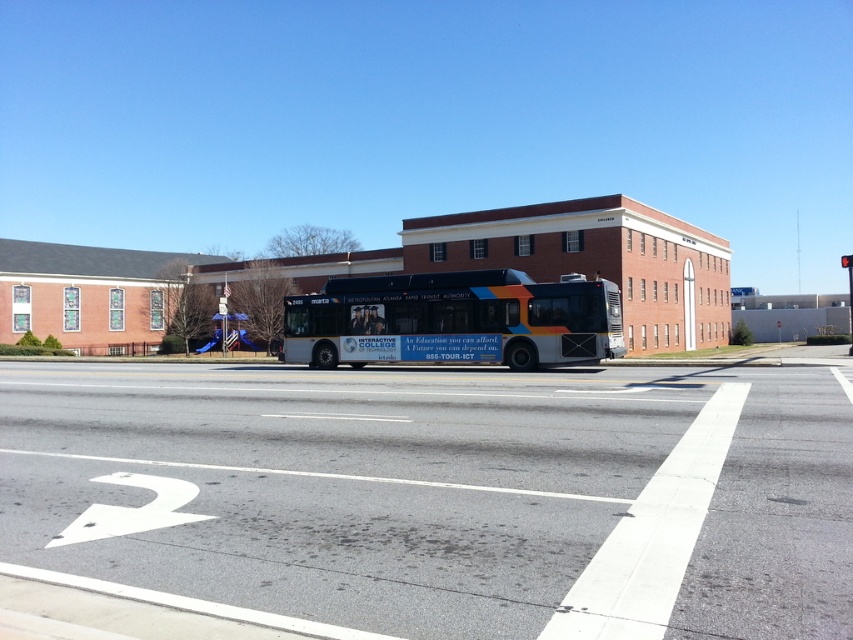
You are a delivery driver who needs to park your van on the gray asphalt at center. The van requires a parking space that is at least as large as the white matte bus at center. Can you park your van there?

The gray asphalt at center occupies less space than the white matte bus at center, so the parking space is not large enough for the van.

You are a delivery person who needs to load a large package into your truck. The package is too big to fit through the narrow alley between the white matte bus at center and the blue plastic slide at lower center. Which object should you move to create more space?

The white matte bus at center is bigger than the blue plastic slide at lower center, so you should move the blue plastic slide at lower center to create more space.